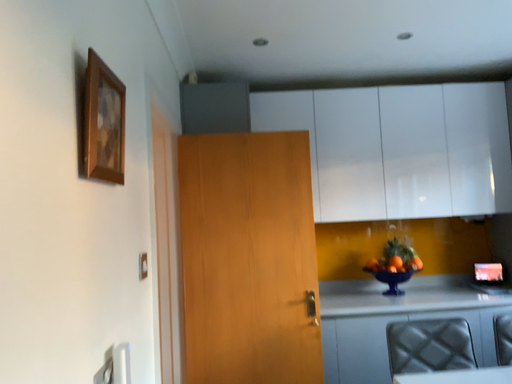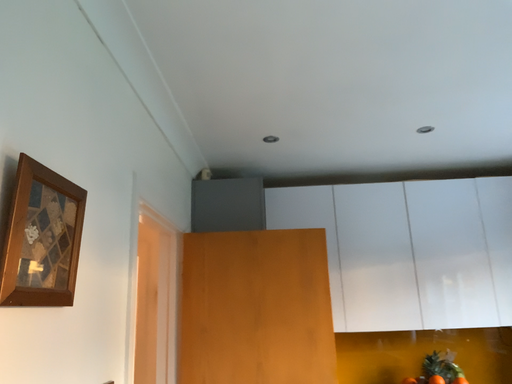
Question: How did the camera likely rotate when shooting the video?

Choices:
 (A) rotated upward
 (B) rotated downward

Answer: (A)